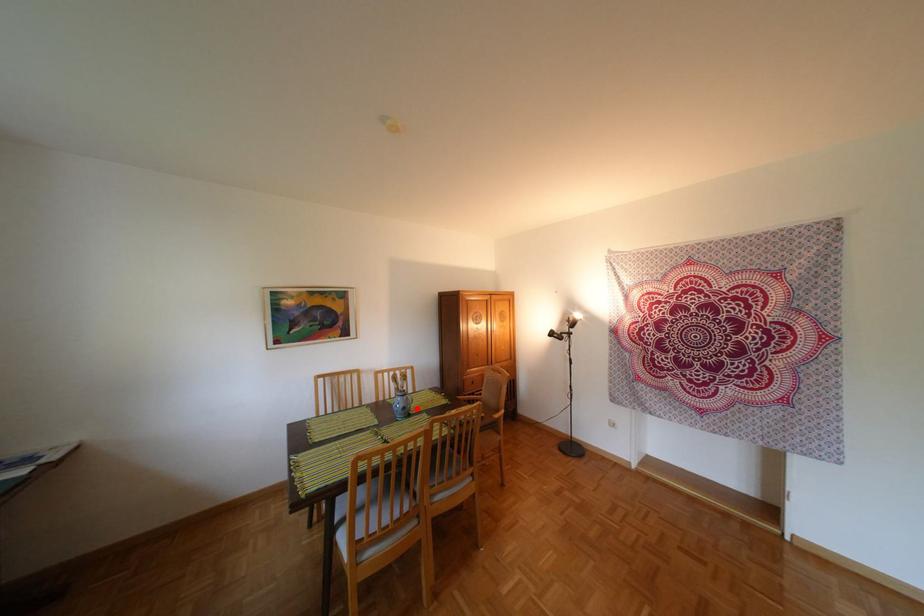
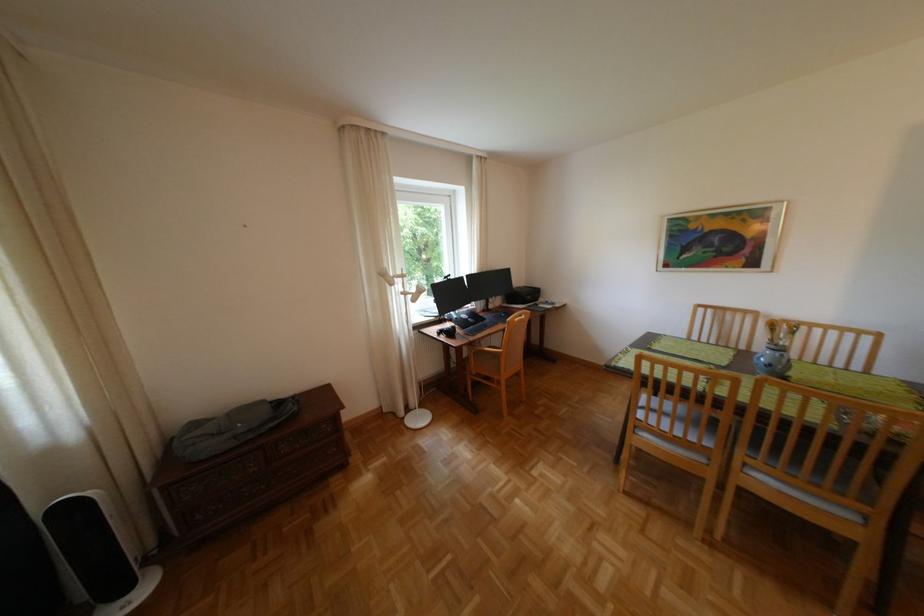
Question: I am providing you with two images of the same scene from different viewpoints. In image1, a red point is highlighted. Considering the same 3D point in image2, which of the following is correct?

Choices:
 (A) It is closer
 (B) It is farther

Answer: (B)